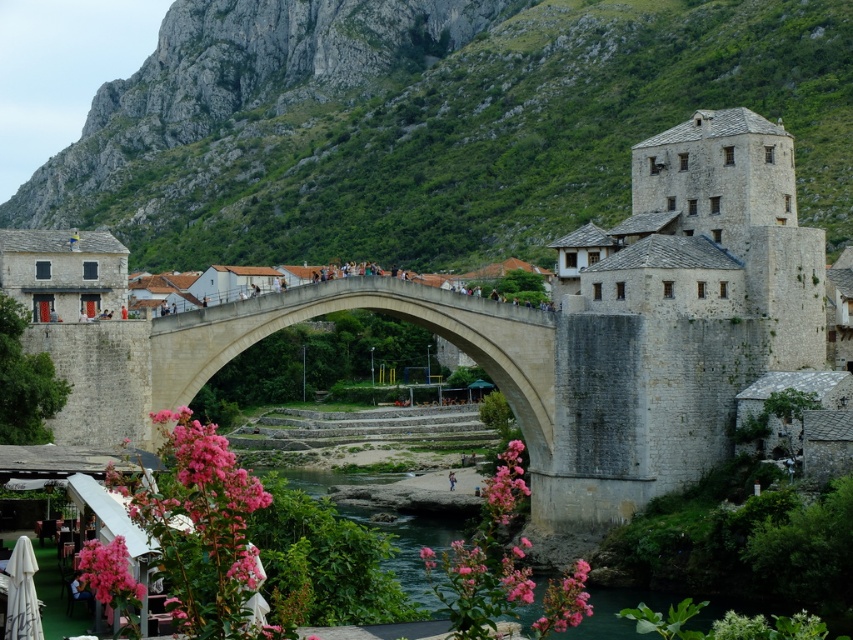
Does stone castle at center have a smaller size compared to gray stone arch bridge at center?

No.

Is point (786, 148) closer to camera compared to point (370, 289)?

No, (786, 148) is further to viewer.

Where is `stone castle at center`? stone castle at center is located at coordinates (552, 330).

Can you confirm if gray stone arch bridge at center is shorter than pink matte flower at lower center?

Incorrect, gray stone arch bridge at center's height does not fall short of pink matte flower at lower center's.

Can you confirm if gray stone arch bridge at center is bigger than pink matte flower at lower center?

Yes.

Does point (380, 285) come farther from viewer compared to point (572, 579)?

Yes, point (380, 285) is behind point (572, 579).

Where is `gray stone arch bridge at center`? Image resolution: width=853 pixels, height=640 pixels. gray stone arch bridge at center is located at coordinates (379, 310).

Which is in front, point (404, 125) or point (122, 376)?

Point (122, 376)

Which is more to the right, green rocky mountain at upper center or stone castle at center?

Positioned to the right is stone castle at center.

This screenshot has width=853, height=640. Find the location of `green rocky mountain at upper center`. green rocky mountain at upper center is located at coordinates (430, 125).